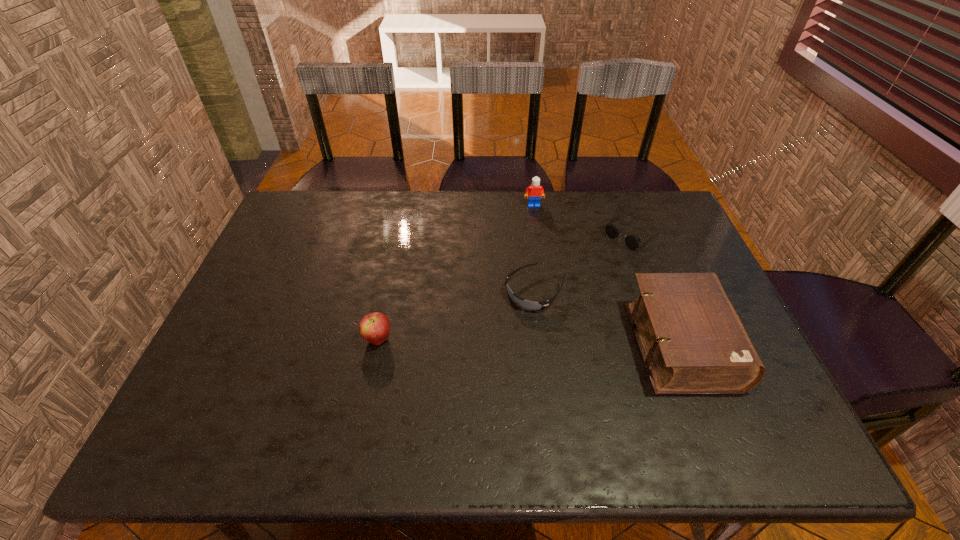
What are the coordinates of `vacant space on the desktop that is between the apple and the Bible and is positioned on the face of the farthest object` in the screenshot? It's located at pyautogui.click(x=560, y=342).

What are the coordinates of `vacant space on the desktop that is between the leftmost object and the Bible and is positioned on the front-facing side of the farther sunglasses` in the screenshot? It's located at (495, 341).

At what (x,y) coordinates should I click in order to perform the action: click on vacant space on the desktop that is between the apple and the Bible and is positioned on the lenses of the left sunglasses. Please return your answer as a coordinate pair (x, y). Looking at the image, I should click on (485, 341).